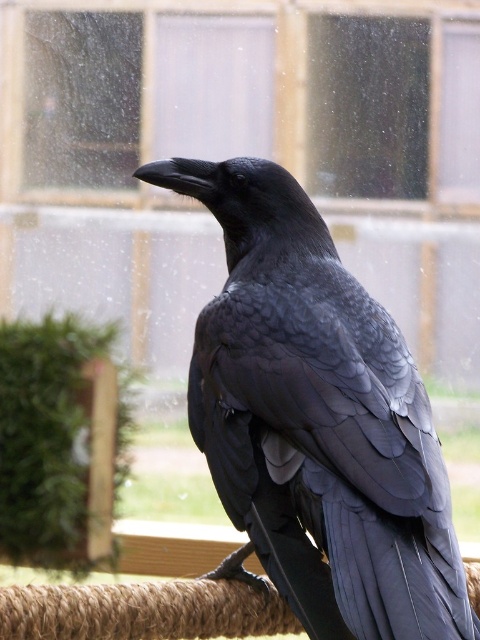
You are a photographer trying to capture the black crow in the image. You notice two specific points marked in the scene. The first point is at coordinates point (377, 83) and the second point is at point (469, 632). Which of these points is closer to the camera lens?

Point (377, 83) is further to the camera than point (469, 632), so the point closer to the camera lens is point (469, 632).

You are a bird enthusiast observing the scene. You notice the transparent glass window at upper center and the black feathered raven at center. Which object is larger in size?

The transparent glass window at upper center has a smaller size compared to the black feathered raven at center, so the black feathered raven at center is larger.

You are a bird enthusiast observing the scene. You notice the transparent glass window at upper center and the black feathered raven at center. Which object is taller?

The transparent glass window at upper center is taller than the black feathered raven at center.